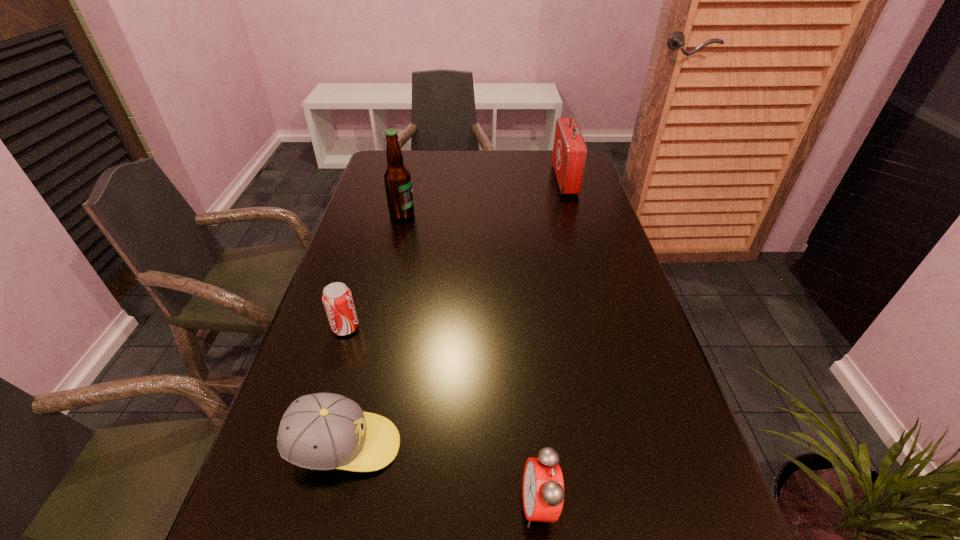
Locate an element on the screen. free space that is in between the third farthest object and the baseball cap is located at coordinates (345, 387).

Where is `free area in between the third nearest object and the first-aid kit`? The image size is (960, 540). free area in between the third nearest object and the first-aid kit is located at coordinates (455, 254).

Locate an element on the screen. This screenshot has height=540, width=960. vacant point located between the beer bottle and the soda can is located at coordinates (373, 271).

Find the location of a particular element. The height and width of the screenshot is (540, 960). unoccupied area between the alarm clock and the beer bottle is located at coordinates (x=470, y=360).

Locate an element on the screen. free space between the farthest object and the soda can is located at coordinates (455, 254).

Locate an element on the screen. This screenshot has height=540, width=960. free space between the tallest object and the third nearest object is located at coordinates tap(373, 271).

I want to click on object that is the closest to the beer bottle, so coord(337,299).

Point out which object is positioned as the second nearest to the second farthest object. Please provide its 2D coordinates. Your answer should be formatted as a tuple, i.e. [(x, y)], where the tuple contains the x and y coordinates of a point satisfying the conditions above.

[(569, 155)]